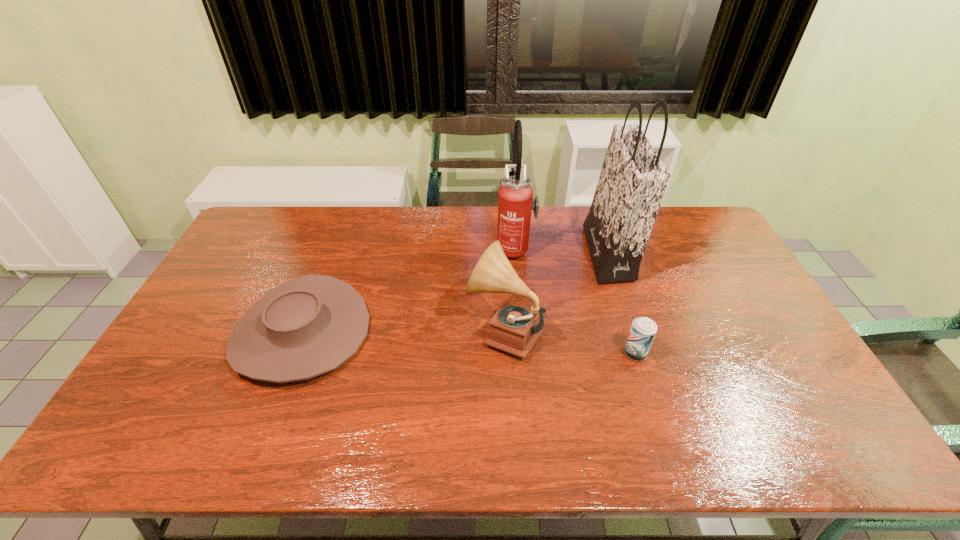
What are the coordinates of `vacant space positioned at the nozzle of the second tallest object` in the screenshot? It's located at (391, 248).

Locate an element on the screen. The image size is (960, 540). blank area located at the nozzle of the second tallest object is located at coordinates (396, 248).

Locate an element on the screen. vacant position located 0.070m on the horn of the third shortest object is located at coordinates (444, 332).

Identify the location of free spot located 0.370m on the horn of the third shortest object. The height and width of the screenshot is (540, 960). (339, 332).

Identify the location of vacant area situated 0.080m on the horn of the third shortest object. This screenshot has height=540, width=960. (440, 332).

Where is `vacant space located on the left of the second shortest object`? The height and width of the screenshot is (540, 960). vacant space located on the left of the second shortest object is located at coordinates (590, 353).

At what (x,y) coordinates should I click in order to perform the action: click on vacant region located on the back of the shortest object. Please return your answer as a coordinate pair (x, y). Image resolution: width=960 pixels, height=540 pixels. Looking at the image, I should click on [347, 213].

Locate an element on the screen. The image size is (960, 540). shopping bag present at the far edge is located at coordinates (633, 179).

Find the location of `fire extinguisher that is positioned at the far edge`. fire extinguisher that is positioned at the far edge is located at coordinates (515, 196).

You are a GUI agent. You are given a task and a screenshot of the screen. Output one action in this format:
    pyautogui.click(x=<x>, y=<y>)
    Task: Click on the object that is at the left edge
    The image size is (960, 540).
    Given the screenshot: What is the action you would take?
    pyautogui.click(x=308, y=326)